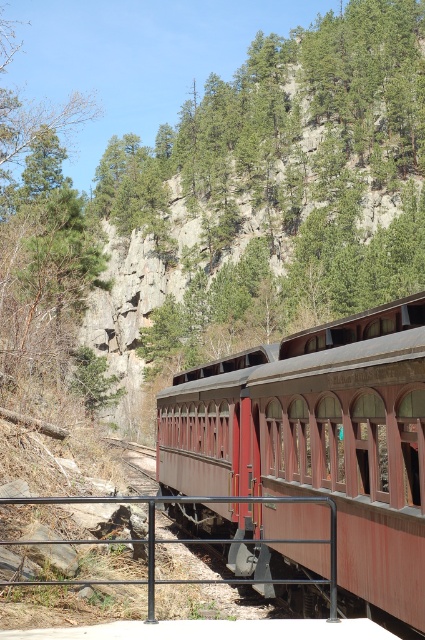
Question: Does matte red train car at center appear over black metal rail at lower center?

Choices:
 (A) no
 (B) yes

Answer: (A)

Question: Which object is farther from the camera taking this photo?

Choices:
 (A) matte red train car at center
 (B) black metal rail at lower center

Answer: (A)

Question: Is matte red train car at center smaller than black metal rail at lower center?

Choices:
 (A) yes
 (B) no

Answer: (B)

Question: Among these points, which one is nearest to the camera?

Choices:
 (A) (149, 545)
 (B) (200, 388)

Answer: (A)

Question: Can you confirm if matte red train car at center is smaller than black metal rail at lower center?

Choices:
 (A) yes
 (B) no

Answer: (B)